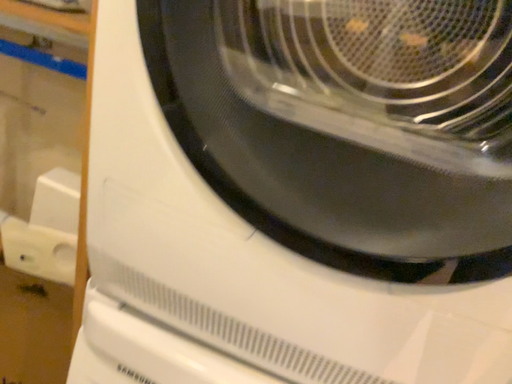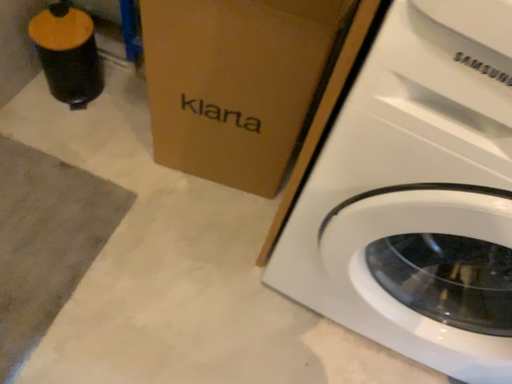
Question: How did the camera likely rotate when shooting the video?

Choices:
 (A) rotated downward
 (B) rotated upward

Answer: (A)